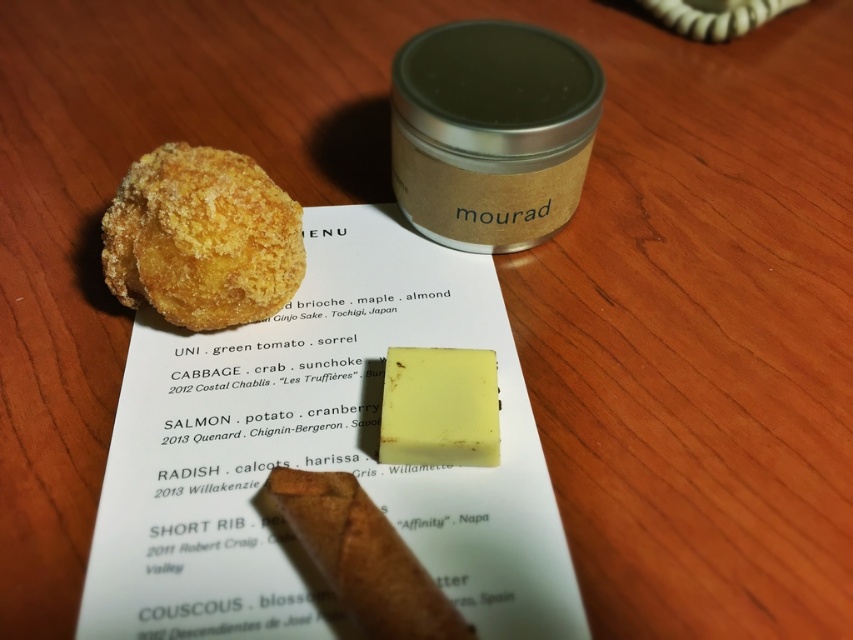
Is golden crispy croquette at upper left closer to camera compared to yellow wax cheese at center?

No, golden crispy croquette at upper left is further to the viewer.

Looking at this image, who is more distant from viewer, (196, 250) or (471, 362)?

Point (471, 362)

At what (x,y) coordinates should I click in order to perform the action: click on golden crispy croquette at upper left. Please return your answer as a coordinate pair (x, y). The height and width of the screenshot is (640, 853). Looking at the image, I should click on (202, 237).